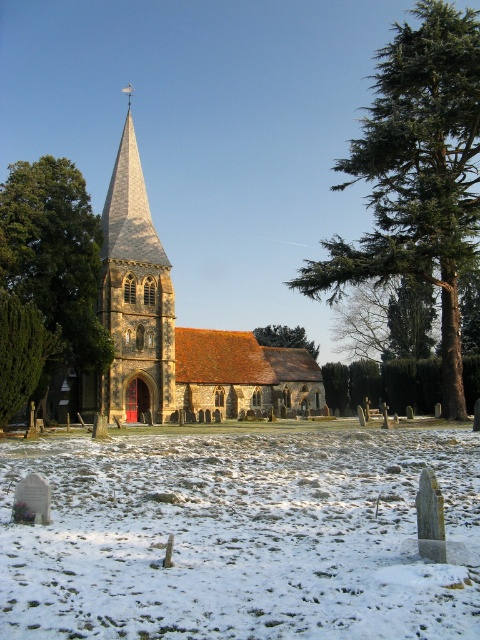
You are standing in the graveyard of the church and see two points marked on the snow. The first point is at coordinates point (117, 378) and the second is at point (272, 328). If you want to walk from the first point to the second point, which direction should you face to move towards the second point?

To move from point (117, 378) to point (272, 328), you should face a direction slightly to the left and downward since the second point is located to the left and lower in the coordinate system compared to the first point.

You are planning to install a new pathway between the green textured tree at right and the smooth stone spire at center. The pathway requires a minimum of 100 feet of space. Based on the scene, will the available distance be sufficient?

The distance between the green textured tree at right and the smooth stone spire at center is 97.02 feet, which is less than the required 100 feet. Therefore, the available distance is insufficient for the pathway.

You are standing in front of the church and want to take a photo of the smooth stone spire at center and the green leafy tree at center. Which object appears closer to the camera in the photo?

The smooth stone spire at center appears closer to the camera because it is positioned over the green leafy tree at center, meaning it is in front of it in the image.